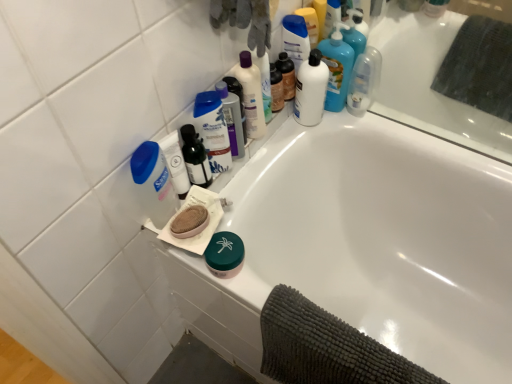
Question: Is white glossy bottle at upper right, marked as the sixth cleaning product in a left-to-right arrangement, oriented towards translucent plastic bottle at upper center, marked as the 3th cleaning product in a right-to-left arrangement?

Choices:
 (A) yes
 (B) no

Answer: (A)

Question: Is white glossy bottle at upper right, marked as the sixth cleaning product in a left-to-right arrangement, completely or partially outside of translucent plastic bottle at upper center, marked as the 3th cleaning product in a right-to-left arrangement?

Choices:
 (A) yes
 (B) no

Answer: (A)

Question: Can you confirm if white glossy bottle at upper right, arranged as the first cleaning product when viewed from the right, is wider than translucent plastic bottle at upper center, the 4th cleaning product in the left-to-right sequence?

Choices:
 (A) yes
 (B) no

Answer: (A)

Question: Is white glossy bottle at upper right, arranged as the first cleaning product when viewed from the right, bigger than translucent plastic bottle at upper center, marked as the 3th cleaning product in a right-to-left arrangement?

Choices:
 (A) yes
 (B) no

Answer: (A)

Question: From a real-world perspective, is white glossy bottle at upper right, marked as the sixth cleaning product in a left-to-right arrangement, over translucent plastic bottle at upper center, marked as the 3th cleaning product in a right-to-left arrangement?

Choices:
 (A) no
 (B) yes

Answer: (A)

Question: From a real-world perspective, is white glossy bottle at upper right, arranged as the first cleaning product when viewed from the right, positioned under translucent plastic bottle at upper center, the 4th cleaning product in the left-to-right sequence, based on gravity?

Choices:
 (A) no
 (B) yes

Answer: (B)

Question: Is blue plastic shampoo bottle at upper center, positioned as the fifth cleaning product in right-to-left order, in front of white glossy bottle at upper center, acting as the 3th mouthwash starting from the left?

Choices:
 (A) no
 (B) yes

Answer: (B)

Question: Is blue plastic shampoo bottle at upper center, positioned as the fifth cleaning product in right-to-left order, facing away from white glossy bottle at upper center, arranged as the 2th mouthwash when viewed from the right?

Choices:
 (A) yes
 (B) no

Answer: (B)

Question: Does blue plastic shampoo bottle at upper center, positioned as the fifth cleaning product in right-to-left order, touch white glossy bottle at upper center, acting as the 3th mouthwash starting from the left?

Choices:
 (A) no
 (B) yes

Answer: (A)

Question: From the image's perspective, would you say blue plastic shampoo bottle at upper center, which is the second cleaning product in left-to-right order, is positioned over white glossy bottle at upper center, arranged as the 2th mouthwash when viewed from the right?

Choices:
 (A) yes
 (B) no

Answer: (B)

Question: Considering the relative positions of blue plastic shampoo bottle at upper center, positioned as the fifth cleaning product in right-to-left order, and white glossy bottle at upper center, arranged as the 2th mouthwash when viewed from the right, in the image provided, is blue plastic shampoo bottle at upper center, positioned as the fifth cleaning product in right-to-left order, to the left of white glossy bottle at upper center, arranged as the 2th mouthwash when viewed from the right, from the viewer's perspective?

Choices:
 (A) no
 (B) yes

Answer: (B)

Question: Does blue plastic shampoo bottle at upper center, positioned as the fifth cleaning product in right-to-left order, turn towards white glossy bottle at upper center, acting as the 3th mouthwash starting from the left?

Choices:
 (A) yes
 (B) no

Answer: (B)

Question: Is white glossy bathtub at upper center looking in the opposite direction of matte black bottle at upper center, the 2th toiletry positioned from the left?

Choices:
 (A) no
 (B) yes

Answer: (A)